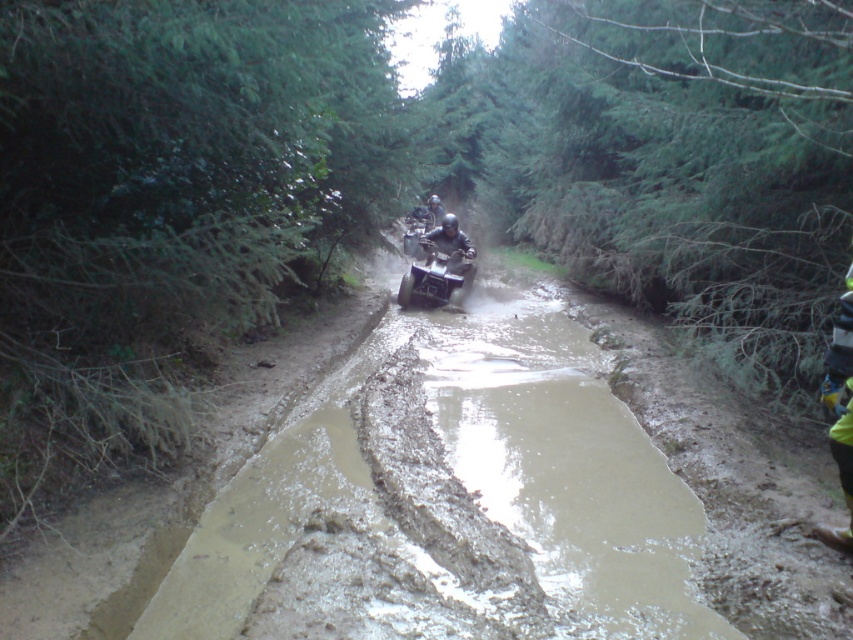
Question: Can you confirm if metallic silver quad bike at center is positioned below matte black quad bike at center?

Choices:
 (A) no
 (B) yes

Answer: (B)

Question: Which point is closer to the camera taking this photo?

Choices:
 (A) (415, 296)
 (B) (448, 225)

Answer: (A)

Question: Which point is farther to the camera?

Choices:
 (A) (471, 275)
 (B) (445, 214)

Answer: (B)

Question: Which object appears closest to the camera in this image?

Choices:
 (A) matte black quad bike at center
 (B) metallic silver quad bike at center

Answer: (B)

Question: Can you confirm if metallic silver quad bike at center is bigger than matte black quad bike at center?

Choices:
 (A) yes
 (B) no

Answer: (A)

Question: Is metallic silver quad bike at center bigger than matte black quad bike at center?

Choices:
 (A) no
 (B) yes

Answer: (B)